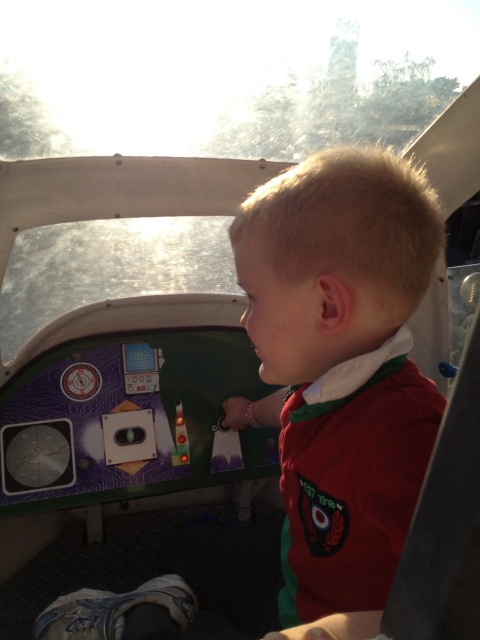
Consider the image. You are designing a uniform for a childrens aviation club. The uniform must include the matte red shirt at center and translucent plastic buttons at center. Considering the spatial relationship between the two items, which item should be placed on the shirt to ensure proper visibility and accessibility?

The translucent plastic buttons at center should be placed on the matte red shirt at center because the shirt is wider, providing enough space to position the buttons in a way that ensures they are both visible and easy to access.

You are a flight attendant checking the cockpit for safety. You see the matte red shirt at center and the translucent plastic buttons at center. Which object is closer to the right side of the cockpit?

The matte red shirt at center is closer to the right side of the cockpit because it is positioned to the right of the translucent plastic buttons at center.

The child is sitting in a cockpit simulator. There is a point at coordinates (310,413). What object is located at that point?

The point at coordinates (310,413) corresponds to the matte red shirt at center.